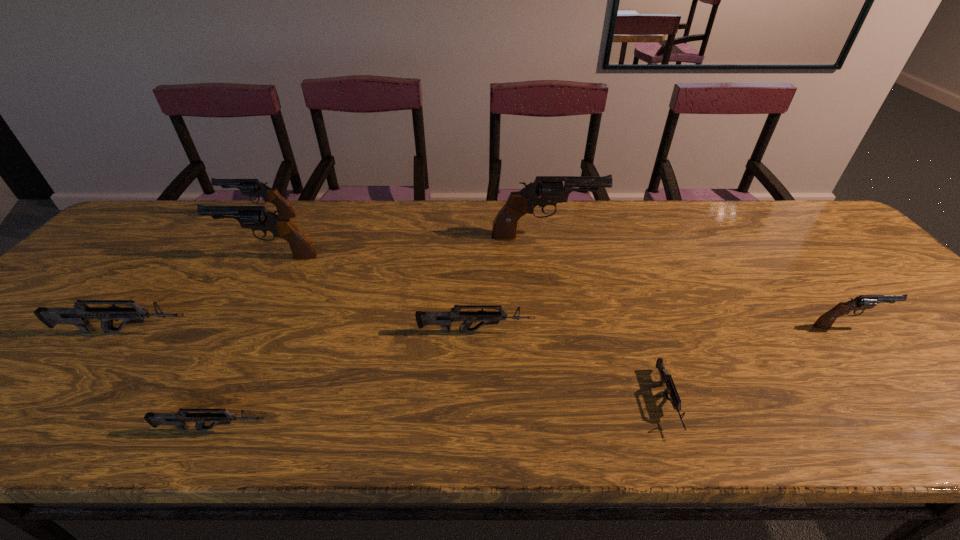
You are a GUI agent. You are given a task and a screenshot of the screen. Output one action in this format:
    pyautogui.click(x=<x>, y=<y>)
    Task: Click on the tallest gun
    This screenshot has width=960, height=540.
    Given the screenshot: What is the action you would take?
    pyautogui.click(x=549, y=191)

You are a GUI agent. You are given a task and a screenshot of the screen. Output one action in this format:
    pyautogui.click(x=<x>, y=<y>)
    Task: Click on the tallest object
    The image size is (960, 540).
    Given the screenshot: What is the action you would take?
    pyautogui.click(x=549, y=191)

At what (x,y) coordinates should I click in order to perform the action: click on the seventh shortest gun. Please return your answer as a coordinate pair (x, y). The height and width of the screenshot is (540, 960). Looking at the image, I should click on (254, 217).

Locate an element on the screen. The height and width of the screenshot is (540, 960). the sixth nearest gun is located at coordinates (254, 217).

Find the location of a particular element. The height and width of the screenshot is (540, 960). the third biggest black gun is located at coordinates click(x=252, y=187).

The image size is (960, 540). What are the coordinates of `the farthest black gun` in the screenshot? It's located at (252, 187).

At what (x,y) coordinates should I click in order to perform the action: click on the rightmost black gun. Please return your answer as a coordinate pair (x, y). Looking at the image, I should click on (862, 302).

Where is `the rightmost object`? Image resolution: width=960 pixels, height=540 pixels. the rightmost object is located at coordinates (862, 302).

The height and width of the screenshot is (540, 960). I want to click on the biggest grey gun, so click(81, 314).

Image resolution: width=960 pixels, height=540 pixels. Identify the location of the sixth tallest gun. (442, 318).